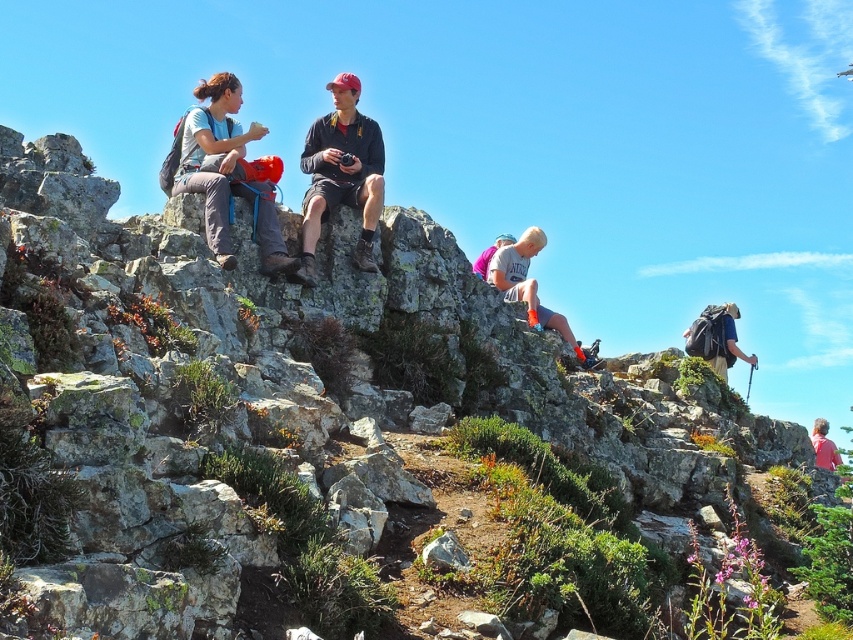
You are a photographer trying to capture a shot of the matte black jacket at center and the pink fabric shirt at lower right. Based on their positions, which one is higher up in the frame?

The matte black jacket at center is above the pink fabric shirt at lower right, so the matte black jacket at center is higher up in the frame.

You are a photographer trying to capture a group shot of the hikers. You notice the blonde hair at center and the pink fabric shirt at lower right in your viewfinder. Which of these two objects appears narrower in your camera frame?

The blonde hair at center appears narrower in the camera frame because it has a lesser width compared to the pink fabric shirt at lower right.